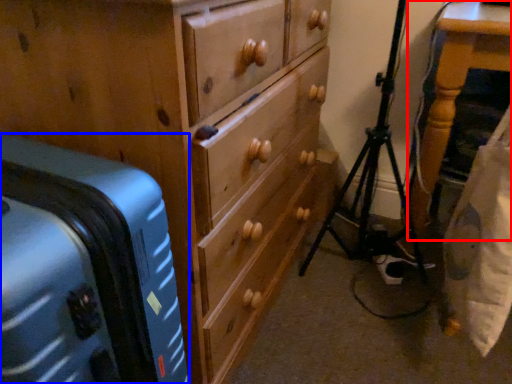
Question: Which object appears closest to the camera in this image, furniture (highlighted by a red box) or suitcase (highlighted by a blue box)?

Choices:
 (A) furniture
 (B) suitcase

Answer: (B)